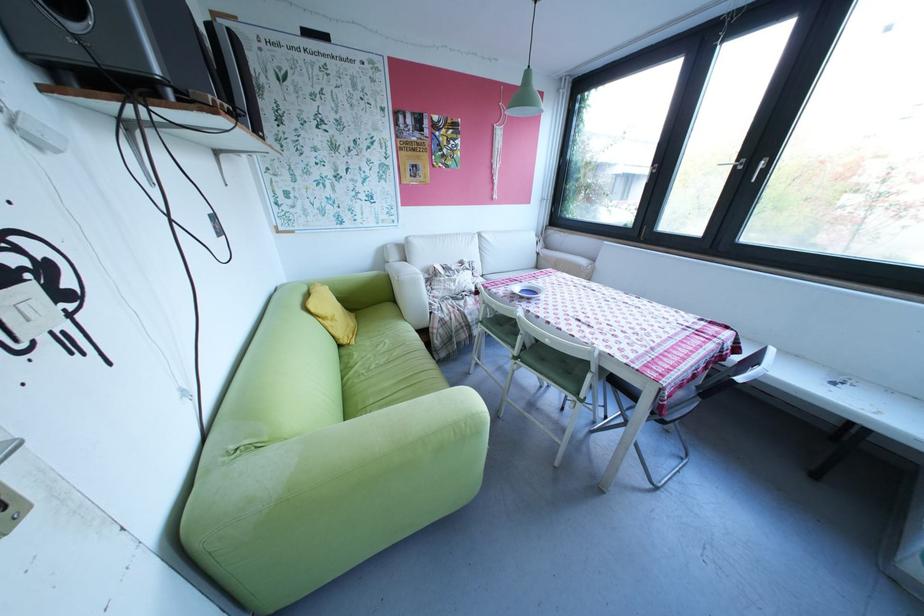
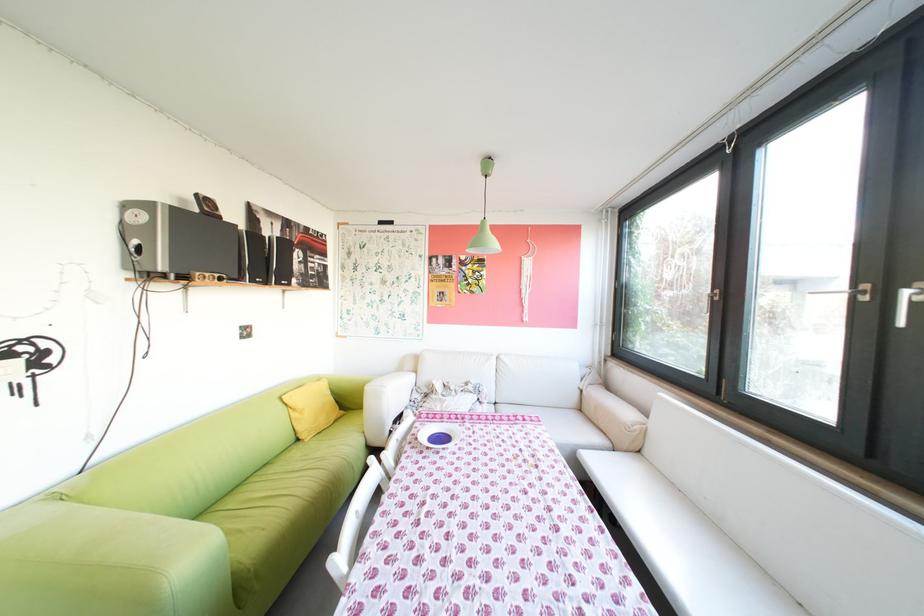
Find the pixel in the second image that matches point 366,342 in the first image.

(321, 440)